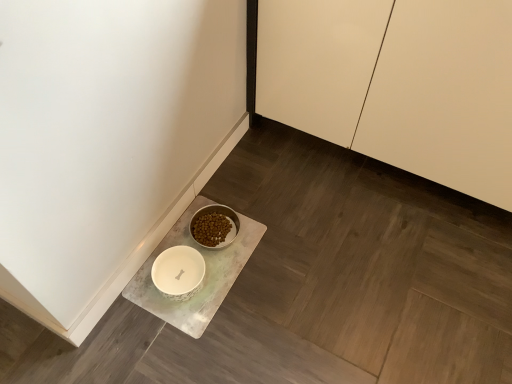
Question: Considering the relative sizes of white marble tray at lower left and white glossy cabinet at upper right in the image provided, is white marble tray at lower left bigger than white glossy cabinet at upper right?

Choices:
 (A) no
 (B) yes

Answer: (A)

Question: Does white marble tray at lower left lie behind white glossy cabinet at upper right?

Choices:
 (A) yes
 (B) no

Answer: (A)

Question: Is white marble tray at lower left outside white glossy cabinet at upper right?

Choices:
 (A) no
 (B) yes

Answer: (B)

Question: Can you confirm if white marble tray at lower left is smaller than white glossy cabinet at upper right?

Choices:
 (A) yes
 (B) no

Answer: (A)

Question: Is white marble tray at lower left far away from white glossy cabinet at upper right?

Choices:
 (A) no
 (B) yes

Answer: (A)

Question: Are white marble tray at lower left and white glossy cabinet at upper right beside each other?

Choices:
 (A) yes
 (B) no

Answer: (B)

Question: Is white glossy cabinet at upper right next to white marble tray at lower left and touching it?

Choices:
 (A) yes
 (B) no

Answer: (B)

Question: Is there a large distance between white glossy cabinet at upper right and white marble tray at lower left?

Choices:
 (A) no
 (B) yes

Answer: (A)

Question: Is white glossy cabinet at upper right further to the viewer compared to white marble tray at lower left?

Choices:
 (A) no
 (B) yes

Answer: (A)

Question: From a real-world perspective, is white glossy cabinet at upper right on white marble tray at lower left?

Choices:
 (A) yes
 (B) no

Answer: (A)

Question: Is white glossy cabinet at upper right looking in the opposite direction of white marble tray at lower left?

Choices:
 (A) yes
 (B) no

Answer: (B)

Question: Is white glossy cabinet at upper right at the left side of white marble tray at lower left?

Choices:
 (A) no
 (B) yes

Answer: (A)

Question: Considering the positions of white glossy cabinet at upper right and white marble tray at lower left in the image, is white glossy cabinet at upper right bigger or smaller than white marble tray at lower left?

Choices:
 (A) big
 (B) small

Answer: (A)